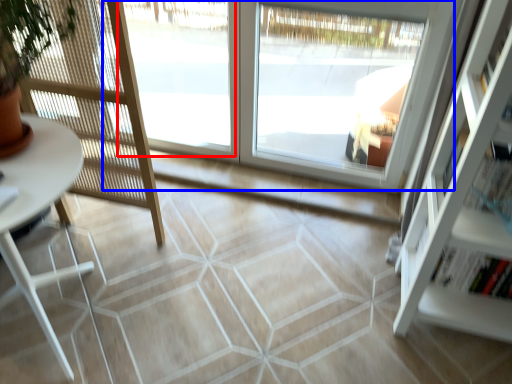
Question: Which point is closer to the camera, window (highlighted by a red box) or window (highlighted by a blue box)?

Choices:
 (A) window
 (B) window

Answer: (B)